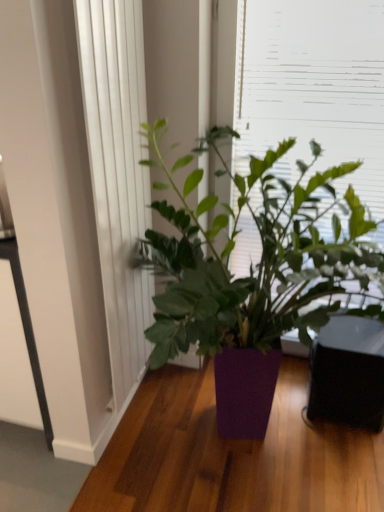
Question: Considering the relative sizes of green leafy plant at upper center and white textured curtain at left in the image provided, is green leafy plant at upper center smaller than white textured curtain at left?

Choices:
 (A) yes
 (B) no

Answer: (B)

Question: Is green leafy plant at upper center positioned behind white textured curtain at left?

Choices:
 (A) no
 (B) yes

Answer: (B)

Question: From a real-world perspective, is green leafy plant at upper center under white textured curtain at left?

Choices:
 (A) yes
 (B) no

Answer: (B)

Question: From the image's perspective, does green leafy plant at upper center appear lower than white textured curtain at left?

Choices:
 (A) no
 (B) yes

Answer: (A)

Question: Is white textured curtain at left a part of green leafy plant at upper center?

Choices:
 (A) no
 (B) yes

Answer: (A)

Question: Looking at their shapes, would you say white textured curtain at left is wider or thinner than purple matte plant at center?

Choices:
 (A) thin
 (B) wide

Answer: (A)

Question: In terms of height, does white textured curtain at left look taller or shorter compared to purple matte plant at center?

Choices:
 (A) tall
 (B) short

Answer: (A)

Question: Is point (145, 94) positioned closer to the camera than point (210, 314)?

Choices:
 (A) closer
 (B) farther

Answer: (B)

Question: Considering the positions of white textured curtain at left and purple matte plant at center in the image, is white textured curtain at left bigger or smaller than purple matte plant at center?

Choices:
 (A) small
 (B) big

Answer: (A)

Question: From a real-world perspective, relative to white textured curtain at left, is purple matte plant at center vertically above or below?

Choices:
 (A) below
 (B) above

Answer: (A)

Question: Is purple matte plant at center spatially inside white textured curtain at left, or outside of it?

Choices:
 (A) outside
 (B) inside

Answer: (A)

Question: Based on their positions, is purple matte plant at center located to the left or right of white textured curtain at left?

Choices:
 (A) left
 (B) right

Answer: (B)

Question: From the image's perspective, is purple matte plant at center above or below white textured curtain at left?

Choices:
 (A) above
 (B) below

Answer: (B)

Question: Is point (314, 74) closer or farther from the camera than point (114, 247)?

Choices:
 (A) closer
 (B) farther

Answer: (B)

Question: Considering the positions of green leafy plant at upper center and white textured curtain at left in the image, is green leafy plant at upper center bigger or smaller than white textured curtain at left?

Choices:
 (A) big
 (B) small

Answer: (A)